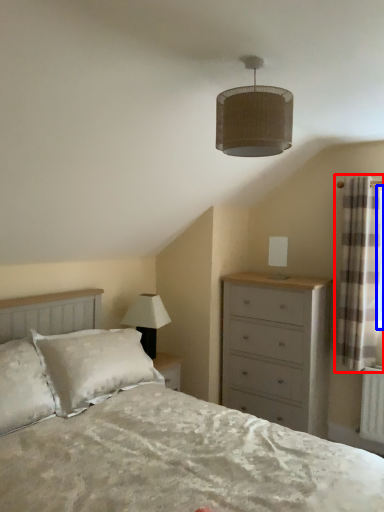
Question: Which object is closer to the camera taking this photo, curtain (highlighted by a red box) or window screen (highlighted by a blue box)?

Choices:
 (A) curtain
 (B) window screen

Answer: (A)